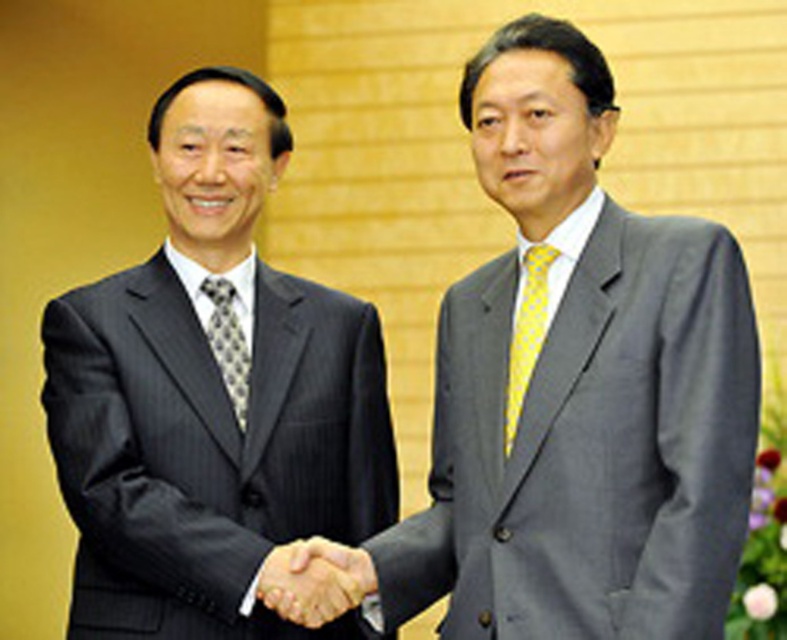
You are a photographer adjusting your camera settings to capture the handshake between the two men. You need to focus on the smooth skin handshake at center and the yellow dotted tie at right. Which object should you focus on first if you want to start from the left side of the frame?

The smooth skin handshake at center should be focused on first because it is positioned to the left of the yellow dotted tie at right.

You are a photographer standing at the location of the viewer. You need to take a portrait of the person wearing the matte gray suit at center. What is the minimum distance you should maintain to ensure the entire suit fits in the frame?

The minimum distance to maintain is 2.50 meters to ensure the entire matte gray suit at center fits within the camera frame.